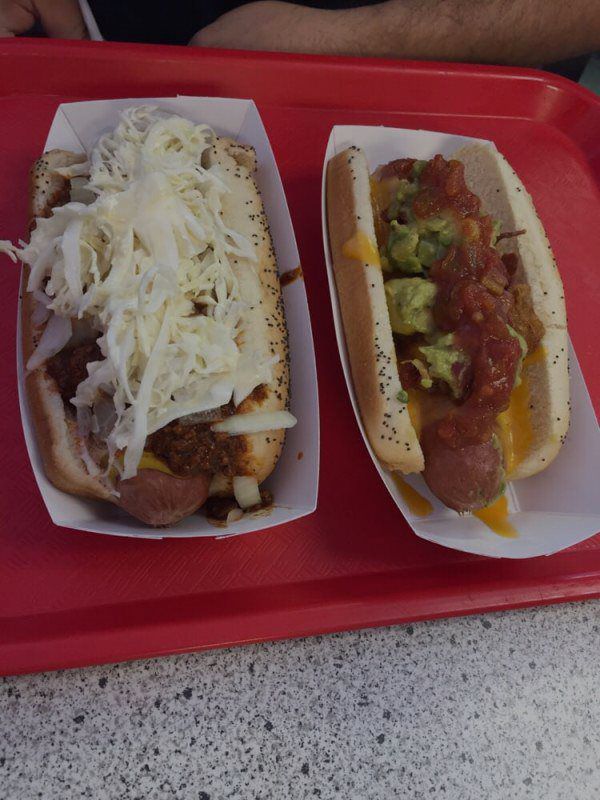
The image size is (600, 800). What are the coordinates of `red tray` in the screenshot? It's located at (372, 594).